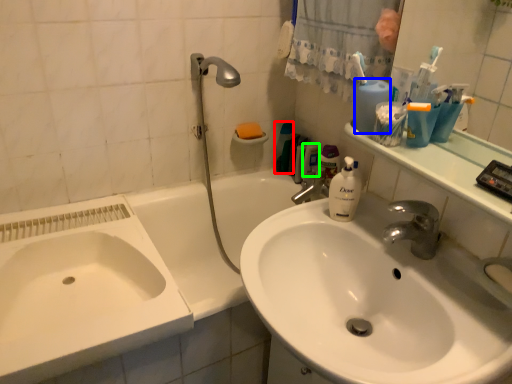
Question: Which object is positioned farthest from mouthwash (highlighted by a red box)? Select from cleaning product (highlighted by a blue box) and mouthwash (highlighted by a green box).

Choices:
 (A) cleaning product
 (B) mouthwash

Answer: (A)